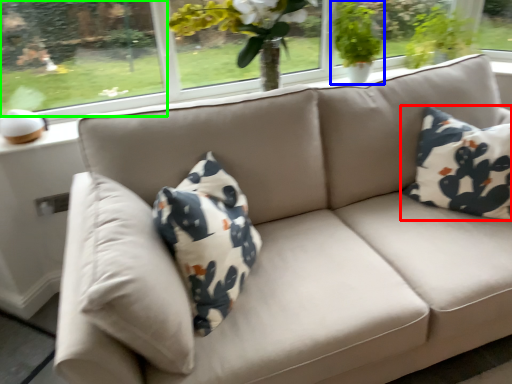
Question: Based on their relative distances, which object is farther from pillow (highlighted by a red box)? Choose from houseplant (highlighted by a blue box) and window screen (highlighted by a green box).

Choices:
 (A) houseplant
 (B) window screen

Answer: (B)